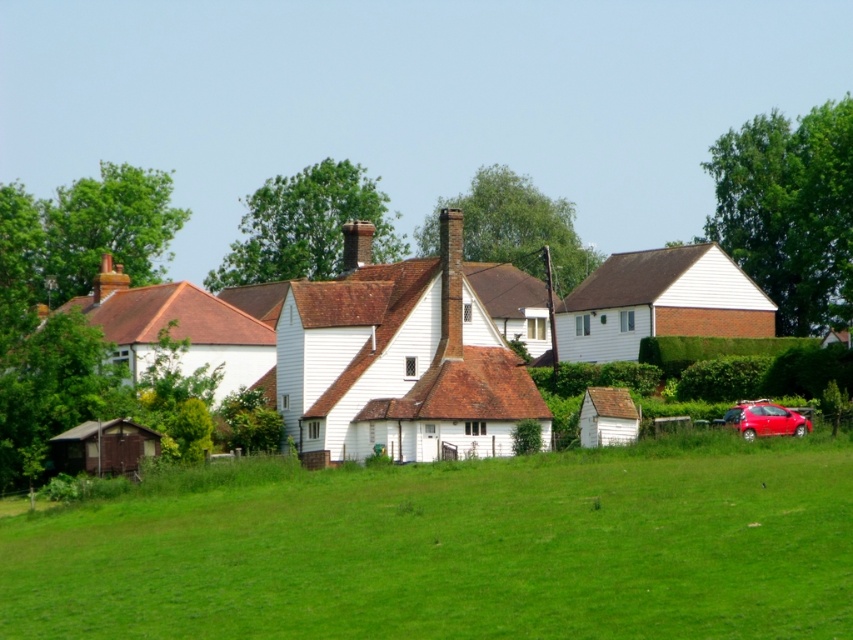
Does green leafy tree at upper right have a larger size compared to green leafy tree at center?

Yes, green leafy tree at upper right is bigger than green leafy tree at center.

Measure the distance between green leafy tree at upper right and green leafy tree at center.

green leafy tree at upper right and green leafy tree at center are 24.11 meters apart.

The height and width of the screenshot is (640, 853). I want to click on green leafy tree at upper right, so click(x=788, y=211).

The height and width of the screenshot is (640, 853). Identify the location of green leafy tree at upper right. (788, 211).

Does green leafy tree at upper center have a lesser width compared to green leafy tree at upper left?

Correct, green leafy tree at upper center's width is less than green leafy tree at upper left's.

Is point (338, 262) closer to viewer compared to point (165, 256)?

Yes, point (338, 262) is in front of point (165, 256).

Between point (322, 244) and point (135, 205), which one is positioned behind?

The point (322, 244) is behind.

You are a GUI agent. You are given a task and a screenshot of the screen. Output one action in this format:
    pyautogui.click(x=<x>, y=<y>)
    Task: Click on the green leafy tree at upper center
    
    Given the screenshot: What is the action you would take?
    pyautogui.click(x=306, y=227)

Does green leafy tree at center have a lesser width compared to shiny red hatchback at lower right?

No, green leafy tree at center is not thinner than shiny red hatchback at lower right.

Find the location of a particular element. The width and height of the screenshot is (853, 640). green leafy tree at center is located at coordinates (514, 227).

Between point (482, 176) and point (786, 419), which one is positioned behind?

The point (482, 176) is more distant.

At what (x,y) coordinates should I click in order to perform the action: click on green leafy tree at center. Please return your answer as a coordinate pair (x, y). Image resolution: width=853 pixels, height=640 pixels. Looking at the image, I should click on (514, 227).